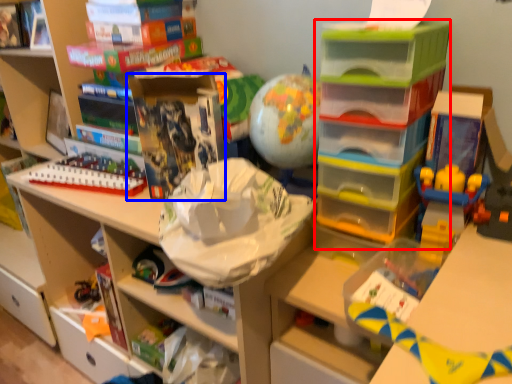
Question: Which of the following is the closest to the observer, shelf (highlighted by a red box) or book (highlighted by a blue box)?

Choices:
 (A) shelf
 (B) book

Answer: (A)